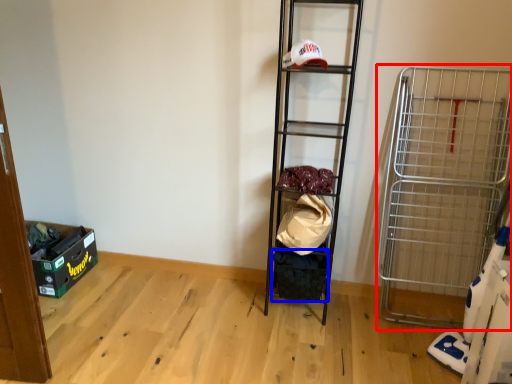
Question: Which object is further to the camera taking this photo, cart (highlighted by a red box) or storage box (highlighted by a blue box)?

Choices:
 (A) cart
 (B) storage box

Answer: (B)